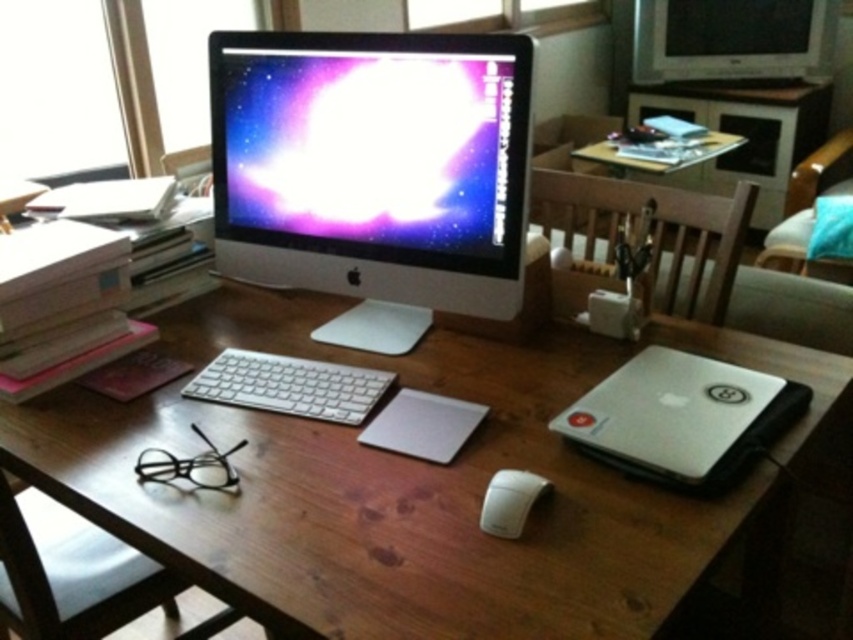
Question: Is wooden chair at center behind silver metallic television at upper right?

Choices:
 (A) yes
 (B) no

Answer: (B)

Question: Which object appears closest to the camera in this image?

Choices:
 (A) white matte mouse at lower right
 (B) white glossy computer monitor at center
 (C) white plastic keyboard at center
 (D) wooden chair at right

Answer: (A)

Question: Does wooden table at center have a lesser width compared to silver metallic television at upper right?

Choices:
 (A) yes
 (B) no

Answer: (B)

Question: Can you confirm if silver/black plastic laptop at right is bigger than silver metallic television at upper right?

Choices:
 (A) yes
 (B) no

Answer: (B)

Question: Which point is closer to the camera taking this photo?

Choices:
 (A) (335, 417)
 (B) (534, 486)
 (C) (677, 362)
 (D) (819, 42)

Answer: (B)

Question: Among these points, which one is farthest from the camera?

Choices:
 (A) (804, 253)
 (B) (558, 305)

Answer: (A)